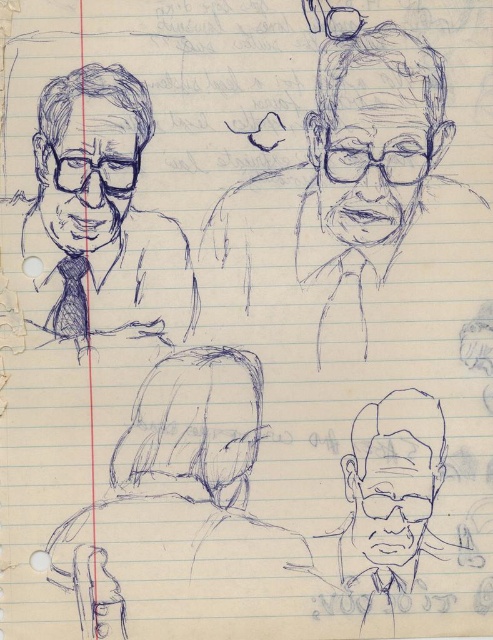
Question: Can you confirm if matte black suit at upper left is wider than smooth gray head at center?

Choices:
 (A) yes
 (B) no

Answer: (A)

Question: Which of the following is the farthest from the observer?

Choices:
 (A) (226, 218)
 (B) (62, 256)
 (C) (139, 96)
 (D) (393, 426)

Answer: (D)

Question: Does graphite pencil sketch of head at upper right appear on the right side of matte black head at lower right?

Choices:
 (A) yes
 (B) no

Answer: (B)

Question: Which point appears farthest from the camera in this image?

Choices:
 (A) (77, 243)
 (B) (180, 456)
 (C) (368, 184)
 (D) (435, 134)

Answer: (B)

Question: Which object appears farthest from the camera in this image?

Choices:
 (A) matte black suit at upper left
 (B) smooth black pen sketch of head at upper left
 (C) smooth gray head at center
 (D) matte black head at lower right

Answer: (C)

Question: Is graphite pencil sketch of head at upper right further to the viewer compared to matte black head at lower right?

Choices:
 (A) no
 (B) yes

Answer: (A)